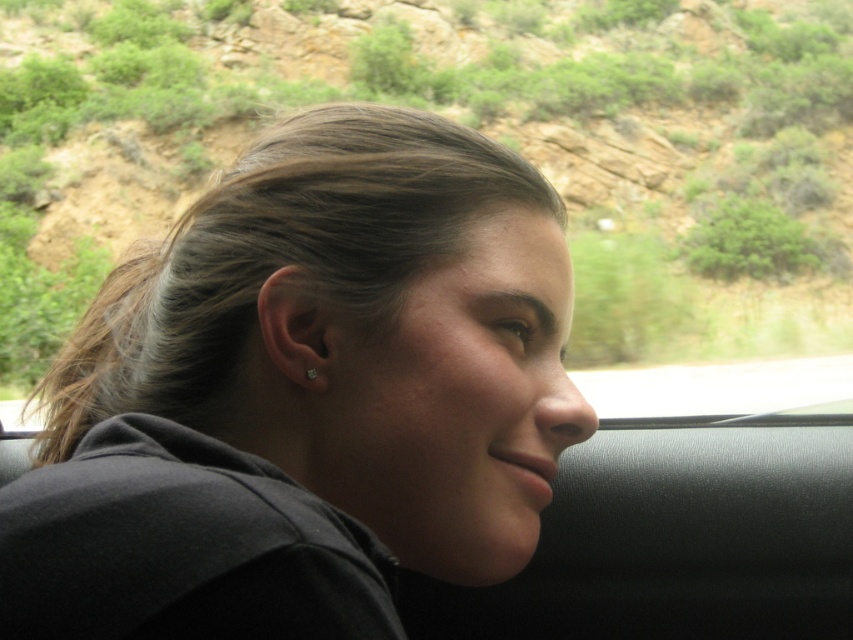
Question: Which point is farther to the camera?

Choices:
 (A) clear crystal earring at ear
 (B) matte black hair at center
 (C) green grassy hillside at upper center

Answer: (C)

Question: Which object is positioned closest to the matte black hair at center?

Choices:
 (A) green grassy hillside at upper center
 (B) clear crystal earring at ear

Answer: (B)

Question: Which object is farther from the camera taking this photo?

Choices:
 (A) green grassy hillside at upper center
 (B) clear crystal earring at ear
 (C) matte black hair at center

Answer: (A)

Question: Is matte black hair at center positioned in front of clear crystal earring at ear?

Choices:
 (A) no
 (B) yes

Answer: (B)

Question: Is matte black hair at center further to camera compared to clear crystal earring at ear?

Choices:
 (A) no
 (B) yes

Answer: (A)

Question: Is the position of green grassy hillside at upper center less distant than that of clear crystal earring at ear?

Choices:
 (A) no
 (B) yes

Answer: (A)